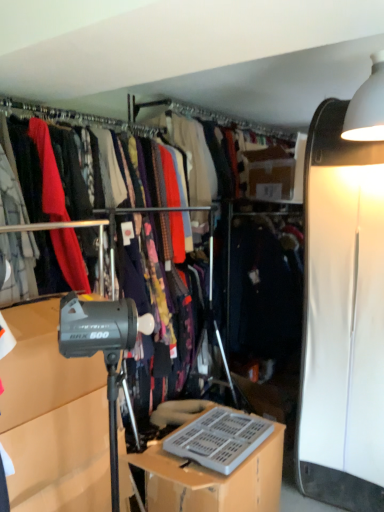
Question: Is point (168, 485) positioned closer to the camera than point (56, 451)?

Choices:
 (A) closer
 (B) farther

Answer: (B)

Question: Considering the positions of gray plastic keyboard at lower center and gray matte tripod at lower left in the image, is gray plastic keyboard at lower center bigger or smaller than gray matte tripod at lower left?

Choices:
 (A) big
 (B) small

Answer: (A)

Question: From their relative heights in the image, would you say gray plastic keyboard at lower center is taller or shorter than gray matte tripod at lower left?

Choices:
 (A) short
 (B) tall

Answer: (A)

Question: Considering the positions of gray matte tripod at lower left and gray plastic keyboard at lower center in the image, is gray matte tripod at lower left wider or thinner than gray plastic keyboard at lower center?

Choices:
 (A) wide
 (B) thin

Answer: (B)

Question: Is point (21, 412) positioned closer to the camera than point (153, 445)?

Choices:
 (A) farther
 (B) closer

Answer: (B)

Question: From a real-world perspective, is gray matte tripod at lower left physically located above or below gray plastic keyboard at lower center?

Choices:
 (A) below
 (B) above

Answer: (B)

Question: From their relative heights in the image, would you say gray matte tripod at lower left is taller or shorter than gray plastic keyboard at lower center?

Choices:
 (A) short
 (B) tall

Answer: (B)